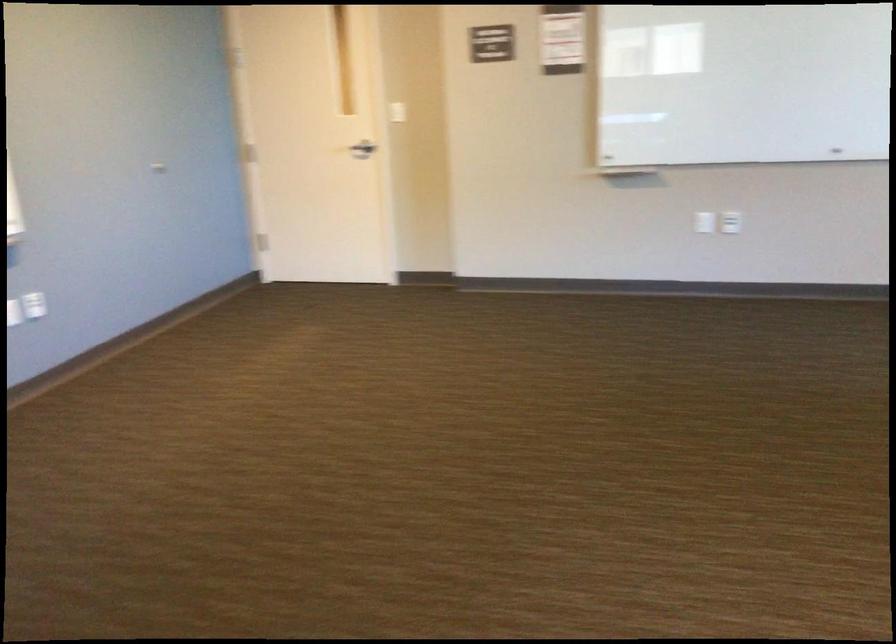
Image resolution: width=896 pixels, height=644 pixels. In order to click on silver door handle in this screenshot , I will do `click(362, 149)`.